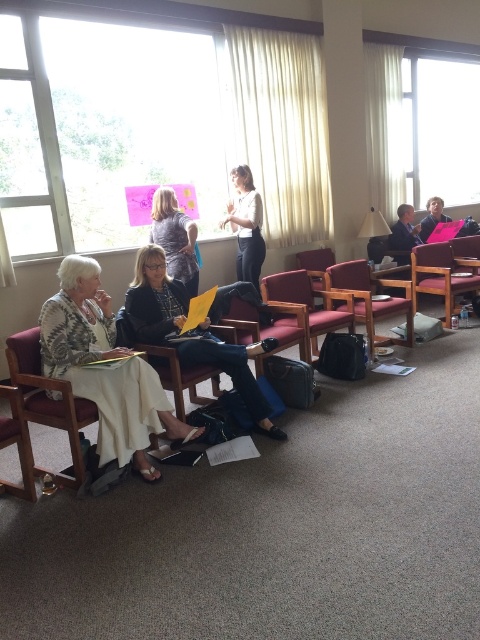
In the scene shown: Can you confirm if white smooth shirt at center is positioned to the right of matte brown armchair at center?

No, white smooth shirt at center is not to the right of matte brown armchair at center.

Does white smooth shirt at center have a lesser height compared to matte brown armchair at center?

In fact, white smooth shirt at center may be taller than matte brown armchair at center.

What do you see at coordinates (245, 225) in the screenshot? The image size is (480, 640). I see `white smooth shirt at center` at bounding box center [245, 225].

Locate an element on the screen. The width and height of the screenshot is (480, 640). white smooth shirt at center is located at coordinates (245, 225).

Does point (300, 278) come behind point (256, 371)?

Yes, point (300, 278) is behind point (256, 371).

The height and width of the screenshot is (640, 480). What do you see at coordinates (310, 301) in the screenshot?
I see `brown leather armchair at center` at bounding box center [310, 301].

Which is behind, point (289, 285) or point (289, 339)?

The point (289, 285) is behind.

I want to click on brown leather armchair at center, so click(x=310, y=301).

Is matte black jacket at center wider than white smooth shirt at center?

Yes.

Where is `matte black jacket at center`? Image resolution: width=480 pixels, height=640 pixels. matte black jacket at center is located at coordinates (190, 333).